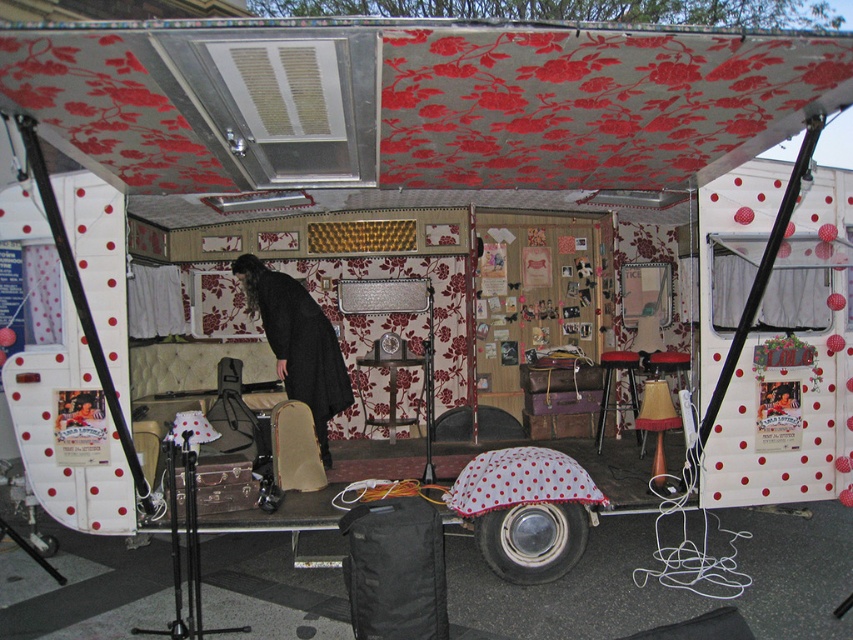
You are standing inside the vintage trailer and notice two points marked on the wall. The first point is at coordinates point (485, 458) and the second point is at point (602, 406). If you are facing the wall, which point is closer to you?

Point (485, 458) is in front of point (602, 406), so it is closer to you when facing the wall.

You are setting up a small stage in the vintage trailer and need to place both the white polka dot fabric umbrella at center and the red fabric stool at center. Since the space is limited, which object should you choose to prioritize keeping if you have to remove one due to size constraints?

The white polka dot fabric umbrella at center has a smaller size compared to the red fabric stool at center, so you should prioritize keeping the white polka dot fabric umbrella at center as it takes up less space.